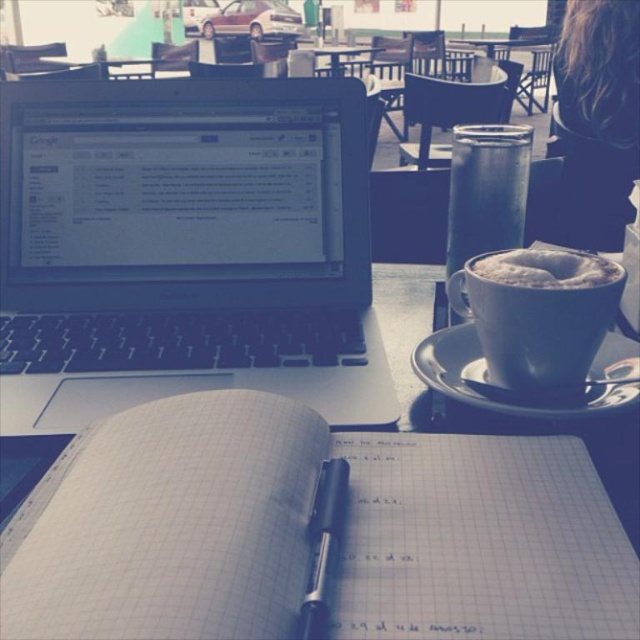
Locate an element on the screen. white frothy foam at upper right is located at coordinates (547, 268).

Which is above, satin silver laptop at upper left or white frothy foam at upper right?

white frothy foam at upper right is above.

Which is behind, point (145, 284) or point (506, 266)?

Positioned behind is point (145, 284).

Locate an element on the screen. The height and width of the screenshot is (640, 640). satin silver laptop at upper left is located at coordinates (182, 246).

Consider the image. Who is more distant from viewer, (397, 557) or (515, 212)?

The point (515, 212) is more distant.

Does white grid paper notebook at center come in front of metallic glass at upper right?

Yes, it is.

Is point (83, 566) positioned before point (483, 134)?

Yes, it is.

Find the location of a particular element. white grid paper notebook at center is located at coordinates (308, 531).